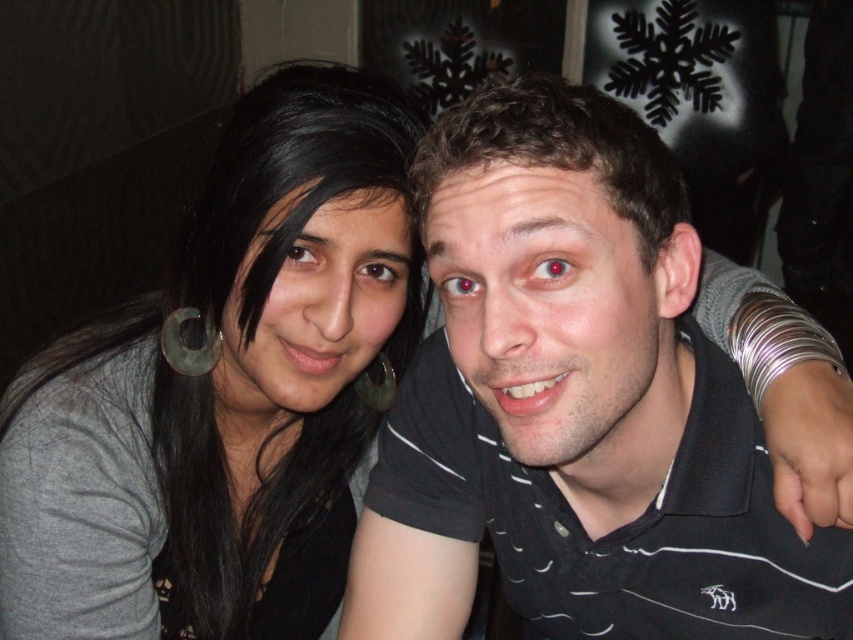
Can you confirm if black jersey at center is wider than gray matte/black hair at upper left?

Correct, the width of black jersey at center exceeds that of gray matte/black hair at upper left.

Image resolution: width=853 pixels, height=640 pixels. In order to click on black jersey at center in this screenshot , I will do `click(572, 401)`.